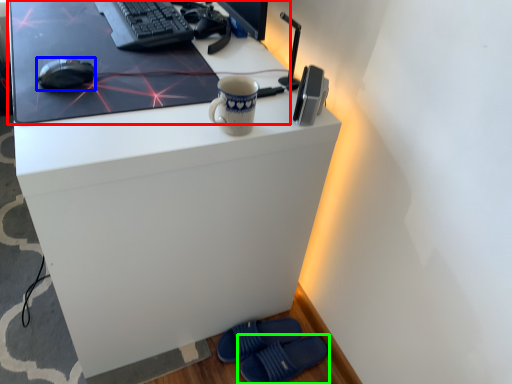
Question: Which is nearer to the desktop (highlighted by a red box)? mouse (highlighted by a blue box) or footwear (highlighted by a green box).

Choices:
 (A) mouse
 (B) footwear

Answer: (A)